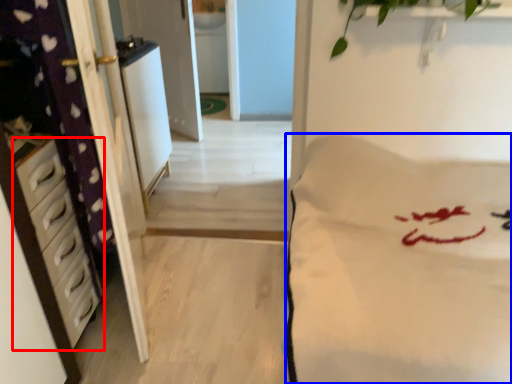
Question: Which object appears closest to the camera in this image, chest of drawers (highlighted by a red box) or mattress (highlighted by a blue box)?

Choices:
 (A) chest of drawers
 (B) mattress

Answer: (B)